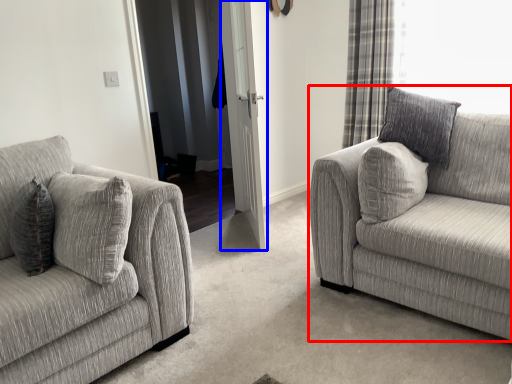
Question: Among these objects, which one is nearest to the camera, studio couch (highlighted by a red box) or screen door (highlighted by a blue box)?

Choices:
 (A) studio couch
 (B) screen door

Answer: (A)